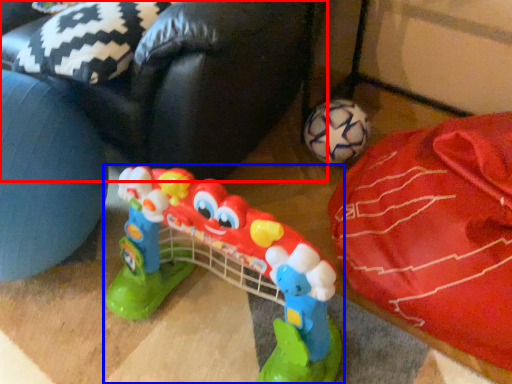
Question: Among these objects, which one is farthest to the camera, bean bag chair (highlighted by a red box) or toy (highlighted by a blue box)?

Choices:
 (A) bean bag chair
 (B) toy

Answer: (A)